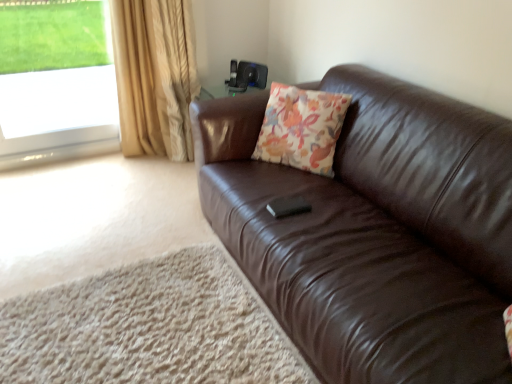
Question: Visually, is gold textured curtain at left positioned to the left or to the right of transparent glass window at upper left?

Choices:
 (A) left
 (B) right

Answer: (B)

Question: Looking at their shapes, would you say gold textured curtain at left is wider or thinner than transparent glass window at upper left?

Choices:
 (A) thin
 (B) wide

Answer: (B)

Question: Which is nearer to the transparent glass window at upper left?

Choices:
 (A) brown leather couch at right
 (B) floral fabric cushion at center
 (C) gold textured curtain at left

Answer: (C)

Question: Which is nearer to the transparent glass window at upper left?

Choices:
 (A) gold textured curtain at left
 (B) brown leather couch at right
 (C) floral fabric cushion at center

Answer: (A)